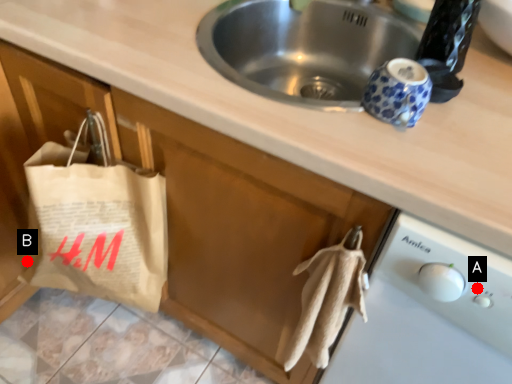
Question: Two points are circled on the image, labeled by A and B beside each circle. Which of the following is the farthest from the observer?

Choices:
 (A) A is further
 (B) B is further

Answer: (B)